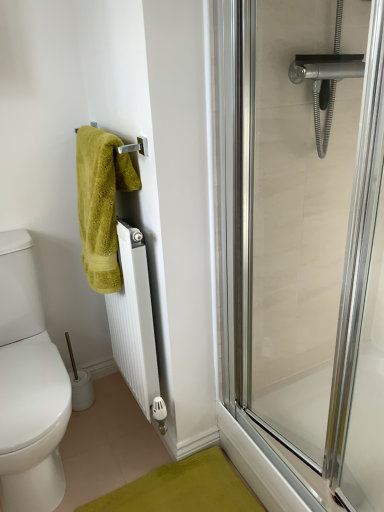
Question: From a real-world perspective, relative to green fuzzy towel at upper left, is clear glass shower door at right vertically above or below?

Choices:
 (A) below
 (B) above

Answer: (A)

Question: Considering the positions of point (243, 220) and point (77, 188), is point (243, 220) closer or farther from the camera than point (77, 188)?

Choices:
 (A) closer
 (B) farther

Answer: (A)

Question: Estimate the real-world distances between objects in this image. Which object is farther from the green fuzzy towel at upper left?

Choices:
 (A) white plastic toilet paper at lower left
 (B) clear glass shower door at right
 (C) white matte radiator at center

Answer: (A)

Question: Based on their relative distances, which object is farther from the white plastic toilet paper at lower left?

Choices:
 (A) white matte radiator at center
 (B) green fuzzy towel at upper left
 (C) clear glass shower door at right

Answer: (C)